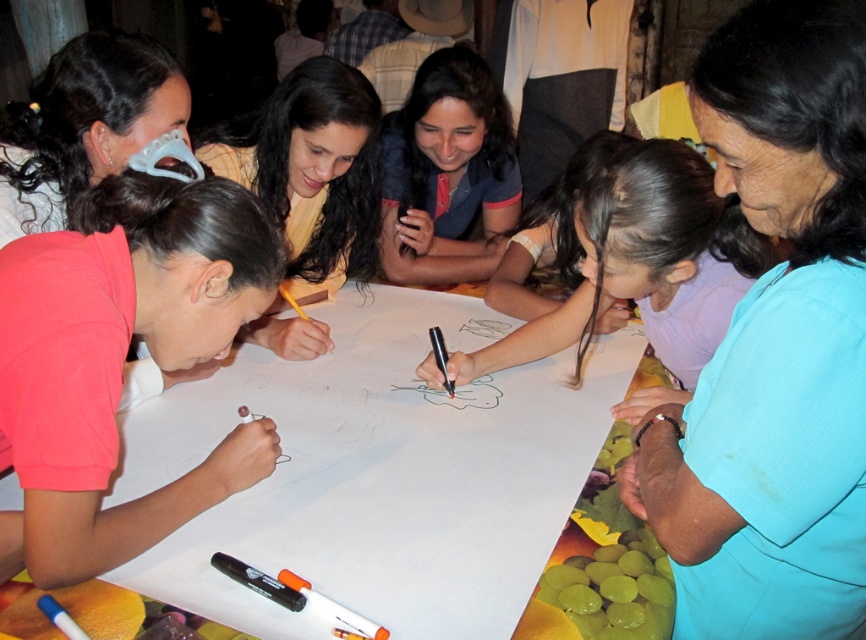
Between smooth purple shirt at center and white plastic marker at lower center, which one appears on the right side from the viewer's perspective?

Positioned to the right is smooth purple shirt at center.

Can you confirm if smooth purple shirt at center is thinner than white plastic marker at lower center?

Incorrect, smooth purple shirt at center's width is not less than white plastic marker at lower center's.

I want to click on smooth purple shirt at center, so click(x=632, y=243).

Find the location of `smooth purple shirt at center`. smooth purple shirt at center is located at coordinates (632, 243).

Is matte plastic mask at upper left closer to camera compared to black plastic pencil at center?

Yes, matte plastic mask at upper left is closer to the viewer.

Who is positioned more to the right, matte plastic mask at upper left or black plastic pencil at center?

From the viewer's perspective, black plastic pencil at center appears more on the right side.

Is point (0, 173) closer to viewer compared to point (436, 358)?

Yes, it is in front of point (436, 358).

Identify the location of matte plastic mask at upper left. The height and width of the screenshot is (640, 866). pos(83,124).

Does point (774, 531) lie in front of point (435, 333)?

Yes, it is in front of point (435, 333).

You are a GUI agent. You are given a task and a screenshot of the screen. Output one action in this format:
    pyautogui.click(x=<x>, y=<y>)
    Task: Click on the light blue shirt at center
    The width and height of the screenshot is (866, 640).
    Given the screenshot: What is the action you would take?
    pyautogui.click(x=774, y=344)